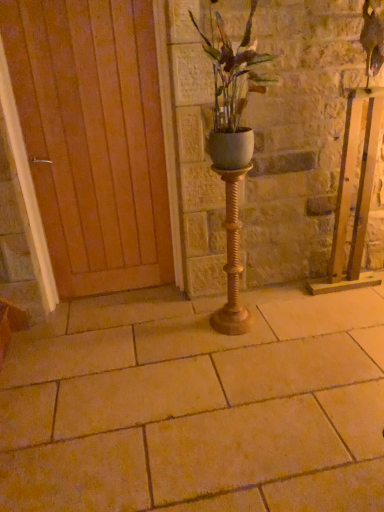
Where is `free point in front of wooden at left`? This screenshot has width=384, height=512. free point in front of wooden at left is located at coordinates (104, 331).